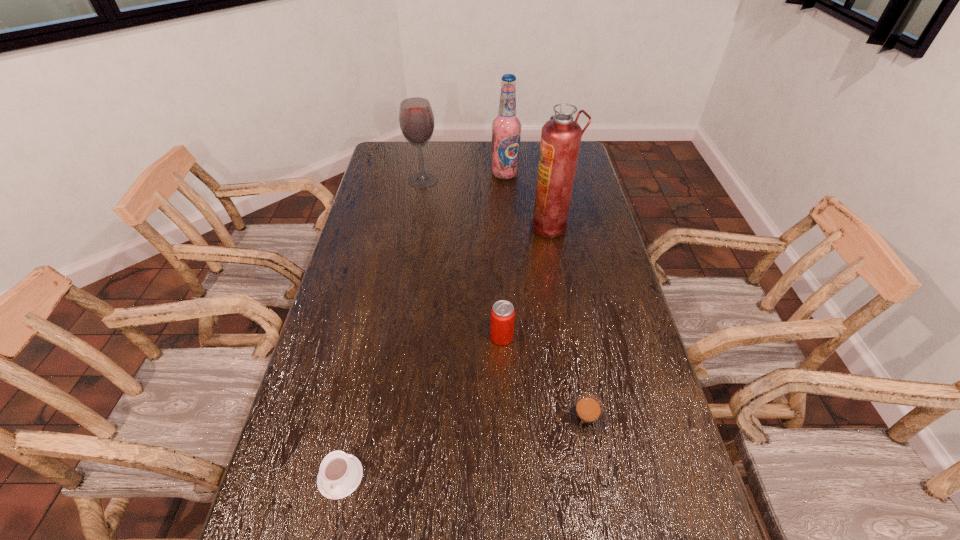
What are the coordinates of `free point located on the side of the third farthest object with the label` in the screenshot? It's located at (512, 227).

In order to click on vacant space located on the back of the right alcohol in this screenshot , I will do `click(504, 161)`.

Find the location of a particular element. Image resolution: width=960 pixels, height=540 pixels. free region located on the right of the left alcohol is located at coordinates (450, 180).

Find the location of `free region located on the right of the third shortest object`. free region located on the right of the third shortest object is located at coordinates (540, 337).

Where is `vacant space situated 0.390m on the left of the fifth farthest object`? The height and width of the screenshot is (540, 960). vacant space situated 0.390m on the left of the fifth farthest object is located at coordinates (409, 417).

Where is `vacant space located on the handle side of the teacup`? The image size is (960, 540). vacant space located on the handle side of the teacup is located at coordinates (327, 536).

The image size is (960, 540). What are the coordinates of `object that is at the far edge` in the screenshot? It's located at (506, 128).

Locate an element on the screen. Image resolution: width=960 pixels, height=540 pixels. alcohol located at the left edge is located at coordinates (416, 119).

Find the location of a particular element. Image resolution: width=960 pixels, height=540 pixels. teacup that is at the left edge is located at coordinates (340, 474).

I want to click on fire extinguisher positioned at the right edge, so click(561, 137).